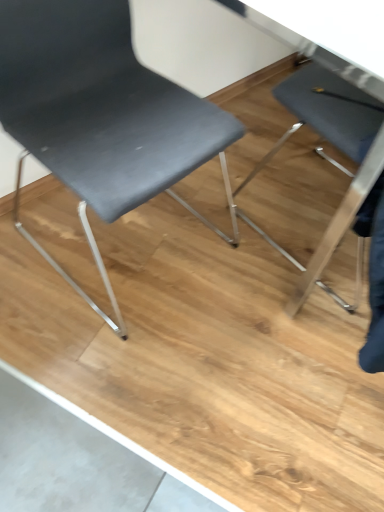
You are a GUI agent. You are given a task and a screenshot of the screen. Output one action in this format:
    pyautogui.click(x=<x>, y=<y>)
    Task: Click on the unoccupied space behind matte black chair at right, marked as the 1th chair in a right-to-left arrangement
    This screenshot has height=512, width=384.
    Given the screenshot: What is the action you would take?
    pyautogui.click(x=288, y=151)